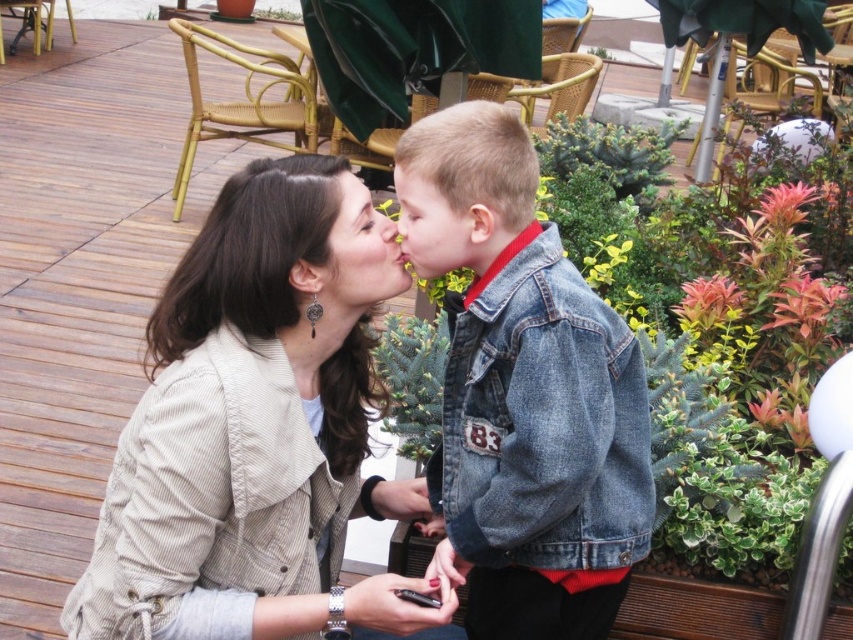
Question: Which is nearer to the beige corduroy jacket at center?

Choices:
 (A) denim jacket at center
 (B) matte skin at center
 (C) smooth skin face at center

Answer: (B)

Question: Is the position of denim jacket at center less distant than that of matte skin at center?

Choices:
 (A) no
 (B) yes

Answer: (B)

Question: Which point is closer to the camera taking this photo?

Choices:
 (A) (521, 492)
 (B) (288, 268)
 (C) (384, 227)

Answer: (A)

Question: Which point appears farthest from the camera in this image?

Choices:
 (A) [x=427, y=250]
 (B) [x=142, y=632]
 (C) [x=602, y=522]

Answer: (C)

Question: Where is denim jacket at center located in relation to smooth skin face at center in the image?

Choices:
 (A) above
 (B) below

Answer: (B)

Question: Does denim jacket at center have a smaller size compared to smooth skin face at center?

Choices:
 (A) no
 (B) yes

Answer: (A)